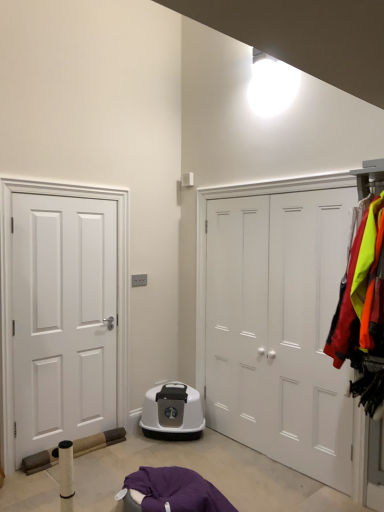
Question: Is white matte door at left, positioned as the first door in left-to-right order, closer to camera compared to white matte door at center, the 1th door from the right?

Choices:
 (A) no
 (B) yes

Answer: (A)

Question: Is white matte door at left, positioned as the first door in left-to-right order, looking in the opposite direction of white matte door at center, the 1th door from the right?

Choices:
 (A) yes
 (B) no

Answer: (B)

Question: Considering the relative positions of white matte door at left, positioned as the first door in left-to-right order, and white matte door at center, the 1th door from the right, in the image provided, is white matte door at left, positioned as the first door in left-to-right order, to the left of white matte door at center, the 1th door from the right, from the viewer's perspective?

Choices:
 (A) yes
 (B) no

Answer: (A)

Question: Are white matte door at left, positioned as the first door in left-to-right order, and white matte door at center, the 2th door from the left, beside each other?

Choices:
 (A) yes
 (B) no

Answer: (B)

Question: Can you confirm if white matte door at left, the 2th door in the right-to-left sequence, is thinner than white matte door at center, the 1th door from the right?

Choices:
 (A) no
 (B) yes

Answer: (A)

Question: Would you say white matte door at left, the 2th door in the right-to-left sequence, is inside or outside reflective nylon jackets at right?

Choices:
 (A) inside
 (B) outside

Answer: (B)

Question: From their relative heights in the image, would you say white matte door at left, the 2th door in the right-to-left sequence, is taller or shorter than reflective nylon jackets at right?

Choices:
 (A) tall
 (B) short

Answer: (A)

Question: From the image's perspective, is white matte door at left, positioned as the first door in left-to-right order, above or below reflective nylon jackets at right?

Choices:
 (A) above
 (B) below

Answer: (B)

Question: Considering the positions of white matte door at left, the 2th door in the right-to-left sequence, and reflective nylon jackets at right in the image, is white matte door at left, the 2th door in the right-to-left sequence, bigger or smaller than reflective nylon jackets at right?

Choices:
 (A) small
 (B) big

Answer: (A)

Question: From the image's perspective, is white matte door at center, the 1th door from the right, above or below white matte door at left, the 2th door in the right-to-left sequence?

Choices:
 (A) below
 (B) above

Answer: (B)

Question: From a real-world perspective, is white matte door at center, the 1th door from the right, physically located above or below white matte door at left, positioned as the first door in left-to-right order?

Choices:
 (A) below
 (B) above

Answer: (B)

Question: Is white matte door at center, the 2th door from the left, wider or thinner than white matte door at left, the 2th door in the right-to-left sequence?

Choices:
 (A) thin
 (B) wide

Answer: (A)

Question: Is white matte door at center, the 1th door from the right, bigger or smaller than white matte door at left, the 2th door in the right-to-left sequence?

Choices:
 (A) small
 (B) big

Answer: (B)

Question: From a real-world perspective, relative to reflective nylon jackets at right, is white matte door at center, the 2th door from the left, vertically above or below?

Choices:
 (A) above
 (B) below

Answer: (B)

Question: Looking at their shapes, would you say white matte door at center, the 1th door from the right, is wider or thinner than reflective nylon jackets at right?

Choices:
 (A) thin
 (B) wide

Answer: (A)